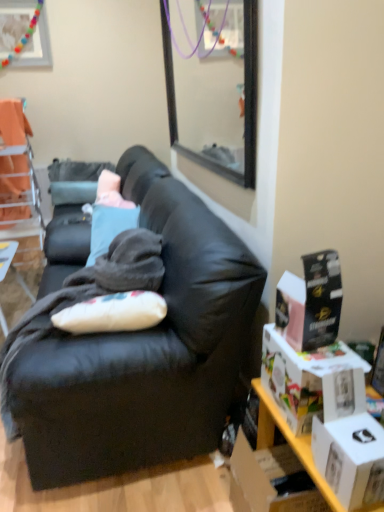
Question: Can you confirm if wooden table at left is positioned to the left of orange fabric chair at upper left?

Choices:
 (A) no
 (B) yes

Answer: (A)

Question: Is orange fabric chair at upper left at the back of wooden table at left?

Choices:
 (A) no
 (B) yes

Answer: (A)

Question: Does wooden table at left have a lesser width compared to orange fabric chair at upper left?

Choices:
 (A) yes
 (B) no

Answer: (A)

Question: Could orange fabric chair at upper left be considered to be inside wooden table at left?

Choices:
 (A) no
 (B) yes

Answer: (A)

Question: From the image's perspective, is wooden table at left beneath orange fabric chair at upper left?

Choices:
 (A) yes
 (B) no

Answer: (A)

Question: Does point (26, 237) appear closer or farther from the camera than point (299, 457)?

Choices:
 (A) closer
 (B) farther

Answer: (B)

Question: From the image's perspective, is orange fabric chair at upper left located above or below white cardboard boxes at right?

Choices:
 (A) below
 (B) above

Answer: (B)

Question: Based on their sizes in the image, would you say orange fabric chair at upper left is bigger or smaller than white cardboard boxes at right?

Choices:
 (A) small
 (B) big

Answer: (B)

Question: Considering the relative positions of orange fabric chair at upper left and white cardboard boxes at right in the image provided, is orange fabric chair at upper left to the left or to the right of white cardboard boxes at right?

Choices:
 (A) left
 (B) right

Answer: (A)

Question: Does point (221, 432) appear closer or farther from the camera than point (372, 502)?

Choices:
 (A) farther
 (B) closer

Answer: (A)

Question: Looking at the image, does black leather couch at center seem bigger or smaller compared to white matte box at lower right, the 1th box positioned from the bottom?

Choices:
 (A) big
 (B) small

Answer: (A)

Question: Considering the relative positions of black leather couch at center and white matte box at lower right, which ranks as the 3th box in top-to-bottom order, in the image provided, is black leather couch at center to the left or to the right of white matte box at lower right, which ranks as the 3th box in top-to-bottom order,?

Choices:
 (A) right
 (B) left

Answer: (B)

Question: Looking at their shapes, would you say black leather couch at center is wider or thinner than white matte box at lower right, which ranks as the 3th box in top-to-bottom order?

Choices:
 (A) thin
 (B) wide

Answer: (B)

Question: Would you say wooden picture frame at upper left is to the left or to the right of white matte box at lower right, the 1th box positioned from the bottom, in the picture?

Choices:
 (A) left
 (B) right

Answer: (A)

Question: From a real-world perspective, is wooden picture frame at upper left above or below white matte box at lower right, which ranks as the 3th box in top-to-bottom order?

Choices:
 (A) below
 (B) above

Answer: (B)